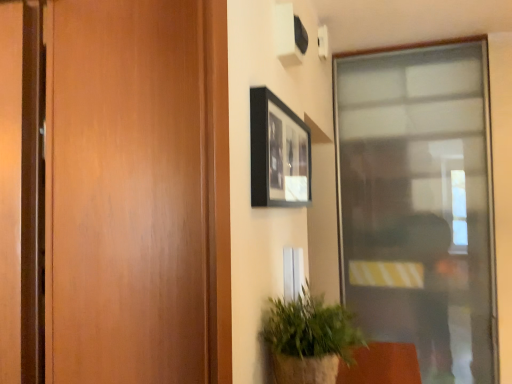
The width and height of the screenshot is (512, 384). I want to click on black matte picture frame at upper center, so click(x=278, y=153).

What do you see at coordinates (309, 339) in the screenshot? Image resolution: width=512 pixels, height=384 pixels. I see `green textured plant at lower right` at bounding box center [309, 339].

Identify the location of black matte picture frame at upper center. Image resolution: width=512 pixels, height=384 pixels. (278, 153).

In the image, is green textured plant at lower right positioned in front of or behind transparent glass door at right?

green textured plant at lower right is positioned closer to the viewer than transparent glass door at right.

Would you say green textured plant at lower right is to the left or to the right of transparent glass door at right in the picture?

From the image, it's evident that green textured plant at lower right is to the left of transparent glass door at right.

Is green textured plant at lower right not near transparent glass door at right?

Yes, green textured plant at lower right and transparent glass door at right are quite far apart.

Is transparent glass door at right wider than black matte picture frame at upper center?

Yes.

Are transparent glass door at right and black matte picture frame at upper center located far from each other?

Yes, transparent glass door at right and black matte picture frame at upper center are located far from each other.

Who is more distant, transparent glass door at right or black matte picture frame at upper center?

transparent glass door at right is behind.

Which of these two, transparent glass door at right or black matte picture frame at upper center, is bigger?

With larger size is transparent glass door at right.

Considering the positions of point (287, 161) and point (284, 380), is point (287, 161) closer or farther from the camera than point (284, 380)?

Point (287, 161) is farther from the camera than point (284, 380).

From a real-world perspective, between black matte picture frame at upper center and green textured plant at lower right, who is vertically higher?

From a 3D spatial view, black matte picture frame at upper center is above.

Considering the sizes of black matte picture frame at upper center and green textured plant at lower right in the image, is black matte picture frame at upper center wider or thinner than green textured plant at lower right?

Considering their sizes, black matte picture frame at upper center looks slimmer than green textured plant at lower right.

Considering the positions of objects black matte picture frame at upper center and green textured plant at lower right in the image provided, who is behind, black matte picture frame at upper center or green textured plant at lower right?

black matte picture frame at upper center.

Between black matte picture frame at upper center and transparent glass door at right, which one appears on the left side from the viewer's perspective?

Positioned to the left is black matte picture frame at upper center.

Looking at the image, does black matte picture frame at upper center seem bigger or smaller compared to transparent glass door at right?

black matte picture frame at upper center is smaller than transparent glass door at right.

Can transparent glass door at right be found inside black matte picture frame at upper center?

Actually, transparent glass door at right is outside black matte picture frame at upper center.

From a real-world perspective, is black matte picture frame at upper center over transparent glass door at right?

Yes.

Which object is positioned more to the right, transparent glass door at right or green textured plant at lower right?

From the viewer's perspective, transparent glass door at right appears more on the right side.

In the scene shown: Between transparent glass door at right and green textured plant at lower right, which one has smaller width?

transparent glass door at right is thinner.

From a real-world perspective, is transparent glass door at right physically above green textured plant at lower right?

Indeed, from a real-world perspective, transparent glass door at right stands above green textured plant at lower right.

How different are the orientations of transparent glass door at right and green textured plant at lower right in degrees?

The facing directions of transparent glass door at right and green textured plant at lower right are 90.8 degrees apart.

Is green textured plant at lower right taller or shorter than black matte picture frame at upper center?

In the image, green textured plant at lower right appears to be shorter than black matte picture frame at upper center.

Between green textured plant at lower right and black matte picture frame at upper center, which one has smaller width?

Thinner between the two is black matte picture frame at upper center.

I want to click on houseplant in front of the transparent glass door at right, so click(309, 339).

Image resolution: width=512 pixels, height=384 pixels. I want to click on picture frame above the transparent glass door at right (from a real-world perspective), so click(278, 153).

Based on their spatial positions, is transparent glass door at right or green textured plant at lower right further from black matte picture frame at upper center?

transparent glass door at right is positioned further to the anchor black matte picture frame at upper center.

When comparing their distances from green textured plant at lower right, does transparent glass door at right or black matte picture frame at upper center seem further?

The object further to green textured plant at lower right is transparent glass door at right.

Based on their spatial positions, is black matte picture frame at upper center or transparent glass door at right further from green textured plant at lower right?

transparent glass door at right.

Based on their spatial positions, is black matte picture frame at upper center or green textured plant at lower right closer to transparent glass door at right?

Among the two, black matte picture frame at upper center is located nearer to transparent glass door at right.

Looking at this image, considering their positions, is green textured plant at lower right positioned further to transparent glass door at right than black matte picture frame at upper center?

The object further to transparent glass door at right is green textured plant at lower right.

From the image, which object appears to be nearer to black matte picture frame at upper center, green textured plant at lower right or transparent glass door at right?

Among the two, green textured plant at lower right is located nearer to black matte picture frame at upper center.

Where is `picture frame between green textured plant at lower right and transparent glass door at right along the z-axis`? picture frame between green textured plant at lower right and transparent glass door at right along the z-axis is located at coordinates (278, 153).